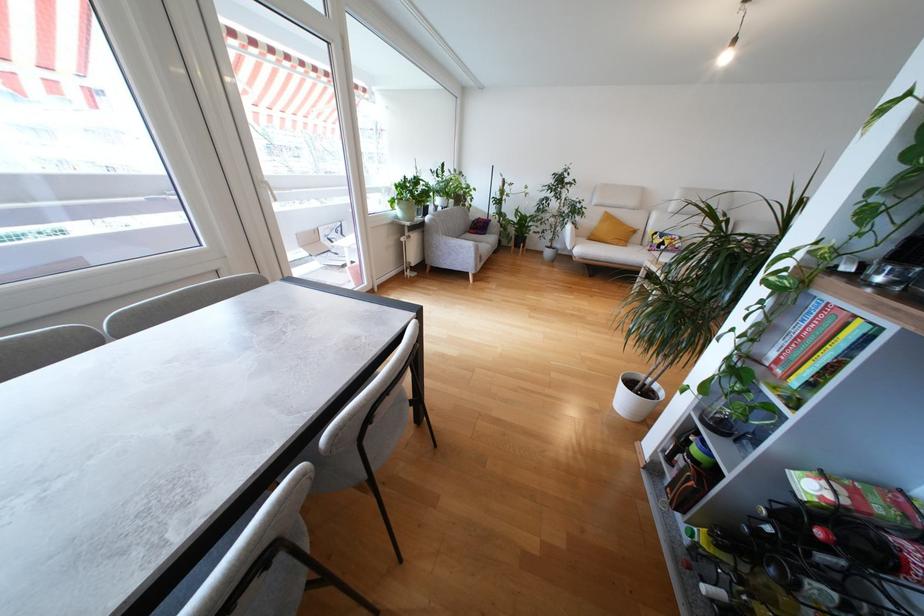
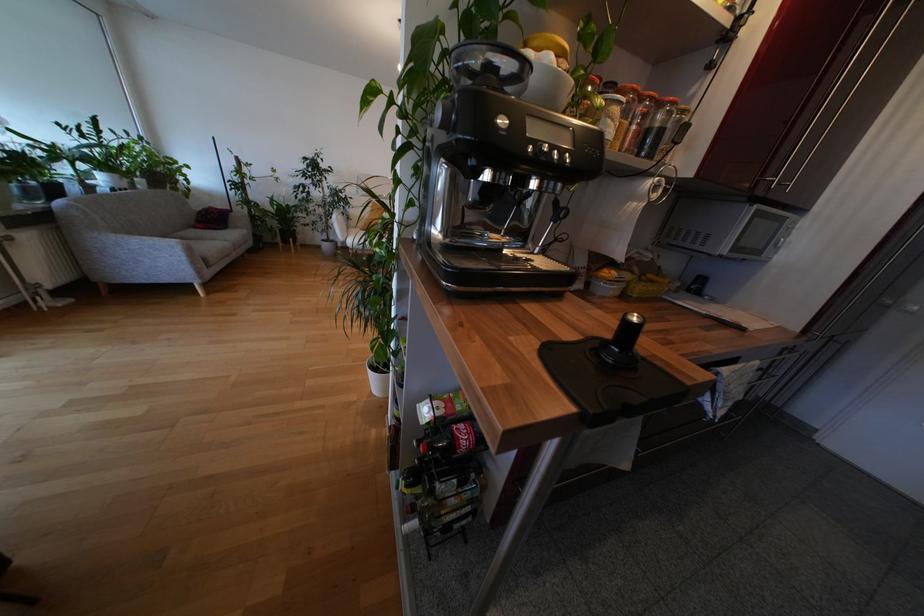
Locate, in the second image, the point that corresponds to [481,251] in the first image.

(192, 252)